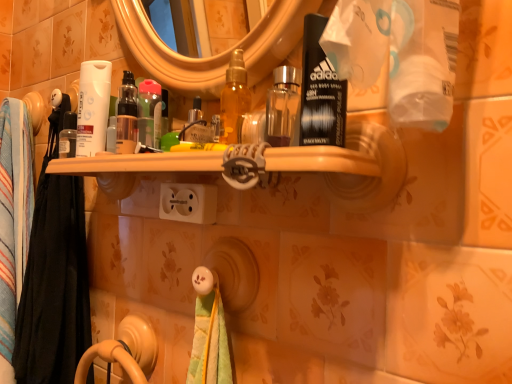
Question: Is white matte tube at left closer to the viewer compared to translucent plastic bottle at center?

Choices:
 (A) yes
 (B) no

Answer: (B)

Question: Is white matte tube at left outside of translucent plastic bottle at center?

Choices:
 (A) no
 (B) yes

Answer: (B)

Question: Does white matte tube at left appear on the right side of translucent plastic bottle at center?

Choices:
 (A) no
 (B) yes

Answer: (A)

Question: Is white matte tube at left positioned far away from translucent plastic bottle at center?

Choices:
 (A) no
 (B) yes

Answer: (A)

Question: Considering the relative positions of white matte tube at left and translucent plastic bottle at center in the image provided, is white matte tube at left to the left of translucent plastic bottle at center from the viewer's perspective?

Choices:
 (A) yes
 (B) no

Answer: (A)

Question: From the image's perspective, does white matte tube at left appear lower than translucent plastic bottle at center?

Choices:
 (A) no
 (B) yes

Answer: (A)

Question: From a real-world perspective, is white matte tube at left positioned over black fabric towel at left, placed as the first bath towel when sorted from back to front, based on gravity?

Choices:
 (A) no
 (B) yes

Answer: (B)

Question: Considering the relative positions of white matte tube at left and black fabric towel at left, placed as the first bath towel when sorted from back to front, in the image provided, is white matte tube at left behind black fabric towel at left, placed as the first bath towel when sorted from back to front,?

Choices:
 (A) no
 (B) yes

Answer: (A)

Question: Is white matte tube at left not inside black fabric towel at left, which is counted as the second bath towel, starting from the front?

Choices:
 (A) yes
 (B) no

Answer: (A)

Question: Is the position of white matte tube at left less distant than that of black fabric towel at left, which is counted as the second bath towel, starting from the front?

Choices:
 (A) yes
 (B) no

Answer: (A)

Question: Is white matte tube at left shorter than black fabric towel at left, placed as the first bath towel when sorted from back to front?

Choices:
 (A) yes
 (B) no

Answer: (A)

Question: Is white matte tube at left wider than black fabric towel at left, which is counted as the second bath towel, starting from the front?

Choices:
 (A) no
 (B) yes

Answer: (A)

Question: Is translucent plastic bottle at center far from white plastic outlet at center?

Choices:
 (A) yes
 (B) no

Answer: (B)